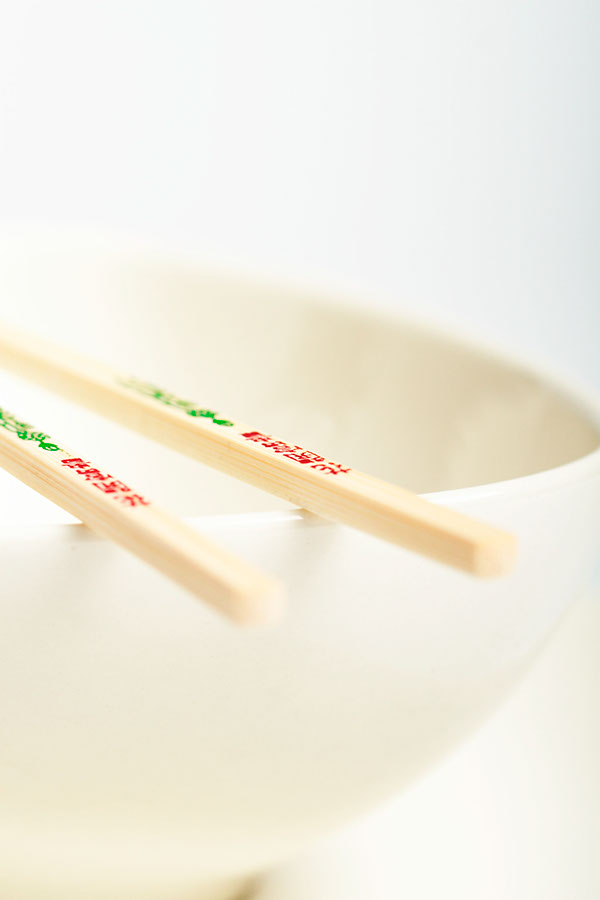
The image size is (600, 900). I want to click on bowl shadow, so click(262, 886).